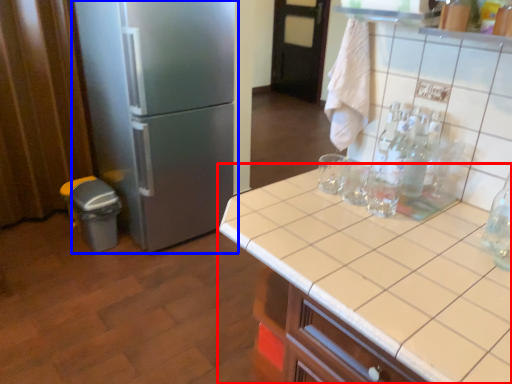
Question: Among these objects, which one is farthest to the camera, countertop (highlighted by a red box) or refrigerator (highlighted by a blue box)?

Choices:
 (A) countertop
 (B) refrigerator

Answer: (B)